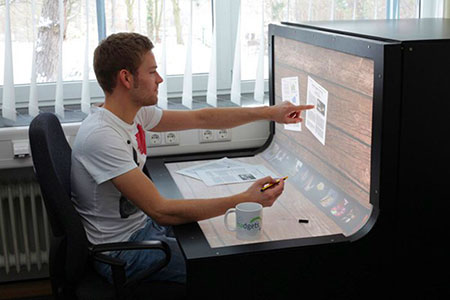
You are a GUI agent. You are given a task and a screenshot of the screen. Output one action in this format:
    pyautogui.click(x=<x>, y=<y>)
    Task: Click on the chair
    Image resolution: width=450 pixels, height=300 pixels.
    Given the screenshot: What is the action you would take?
    pyautogui.click(x=63, y=206)